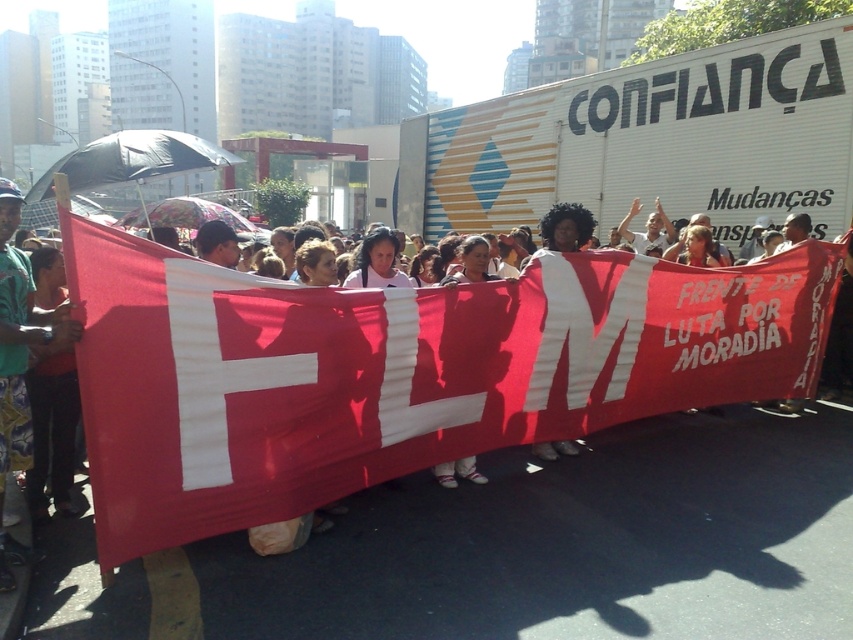
Question: Which point is closer to the camera taking this photo?

Choices:
 (A) (10, 224)
 (B) (148, 401)

Answer: (B)

Question: Among these objects, which one is nearest to the camera?

Choices:
 (A) red fabric banner at center
 (B) green fabric shirt at center

Answer: (A)

Question: Does red fabric banner at center have a smaller size compared to green fabric shirt at center?

Choices:
 (A) no
 (B) yes

Answer: (A)

Question: Does red fabric banner at center appear on the right side of green fabric shirt at center?

Choices:
 (A) no
 (B) yes

Answer: (B)

Question: Which of the following is the farthest from the observer?

Choices:
 (A) pos(288,292)
 (B) pos(21,436)

Answer: (B)

Question: Does red fabric banner at center appear over green fabric shirt at center?

Choices:
 (A) yes
 (B) no

Answer: (B)